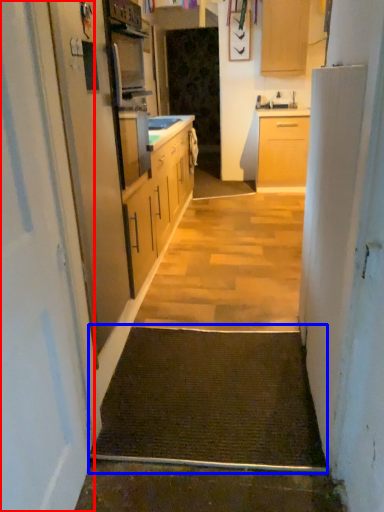
Question: Which object appears closest to the camera in this image, door (highlighted by a red box) or doormat (highlighted by a blue box)?

Choices:
 (A) door
 (B) doormat

Answer: (A)